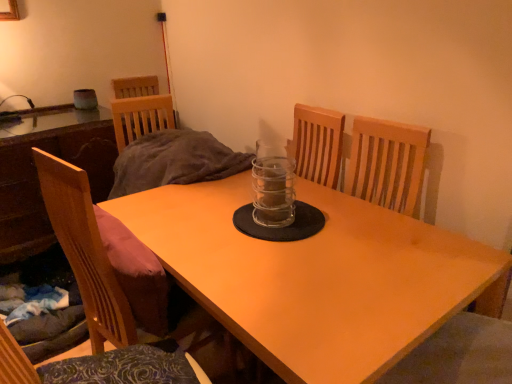
You are a GUI agent. You are given a task and a screenshot of the screen. Output one action in this format:
    pyautogui.click(x=<x>, y=<y>)
    Task: Click on the vacant space in front of transparent glass jar at center
    The width and height of the screenshot is (512, 384).
    Given the screenshot: What is the action you would take?
    pyautogui.click(x=278, y=248)